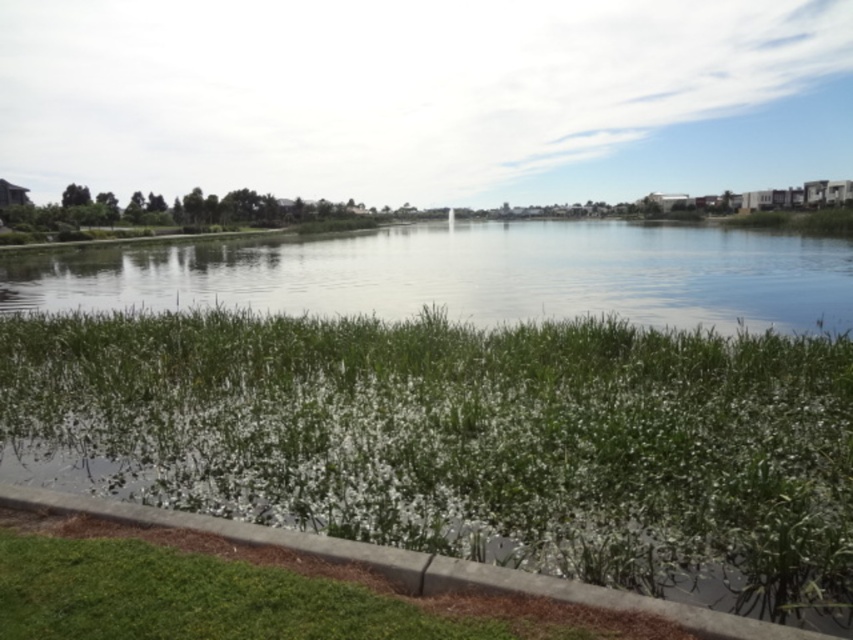
You are standing on the concrete at lower left and want to walk towards the green grassy river at center. Which direction should you move to reach it?

You should move upward because the green grassy river at center is located above the concrete at lower left.

You are standing at the center of the image and want to walk towards the green leafy grass at lower center. Which direction should you move to reach it?

You should move towards the lower center direction to reach the green leafy grass at lower center, as it is located at point coordinates of (469, 440).

You are a gardener who wants to plant flowers in the area. Which area is more suitable for planting flowers between the green leafy grass at lower center and the concrete at lower left?

The green leafy grass at lower center is more suitable for planting flowers since it is a natural vegetation area, while the concrete at lower left is an impermeable surface not suitable for planting.